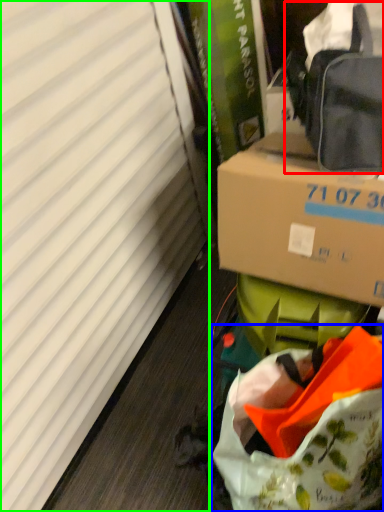
Question: Which object is positioned closest to pack (highlighted by a red box)? Select from bag (highlighted by a blue box) and curtain (highlighted by a green box).

Choices:
 (A) bag
 (B) curtain

Answer: (A)